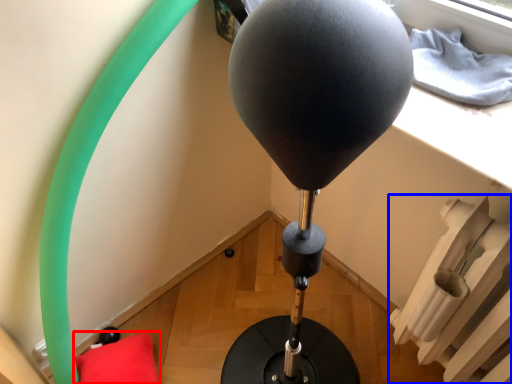
Question: Which object is closer to the camera taking this photo, pillow (highlighted by a red box) or radiator (highlighted by a blue box)?

Choices:
 (A) pillow
 (B) radiator

Answer: (B)